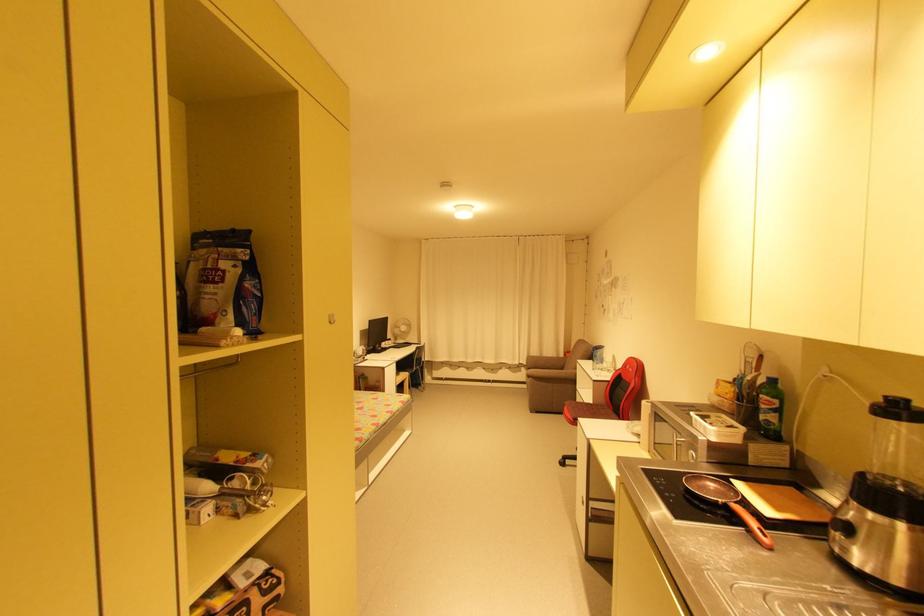
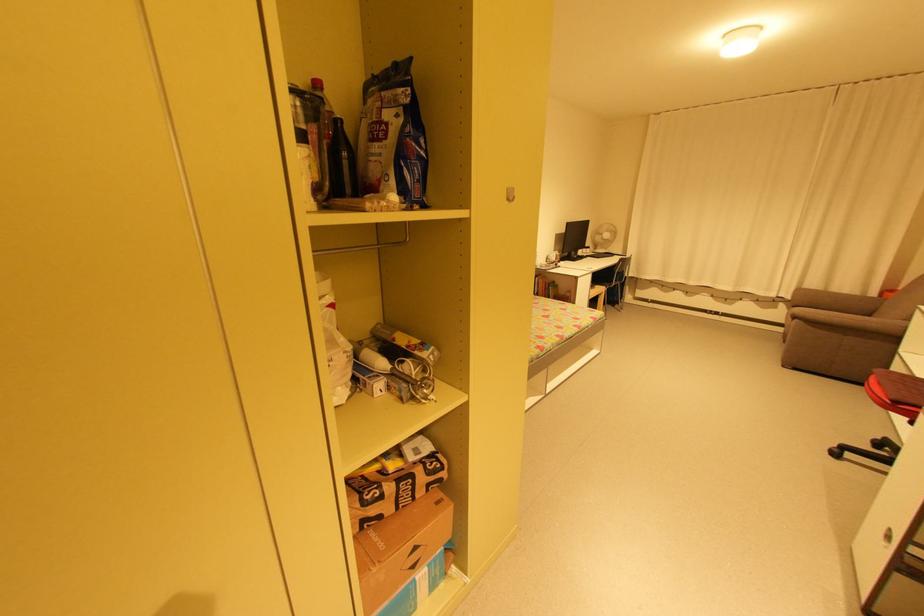
Locate, in the second image, the point that corresponds to [395,342] in the first image.

(592, 249)